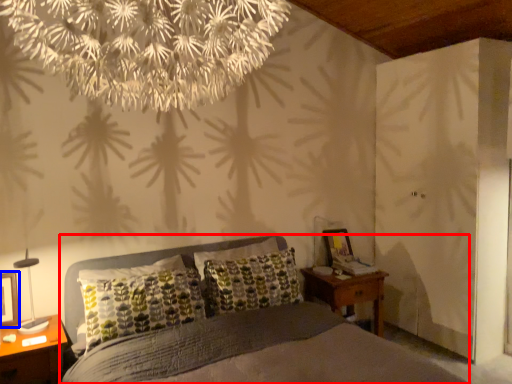
Question: Which of the following is the closest to the observer, bed (highlighted by a red box) or picture frame (highlighted by a blue box)?

Choices:
 (A) bed
 (B) picture frame

Answer: (A)